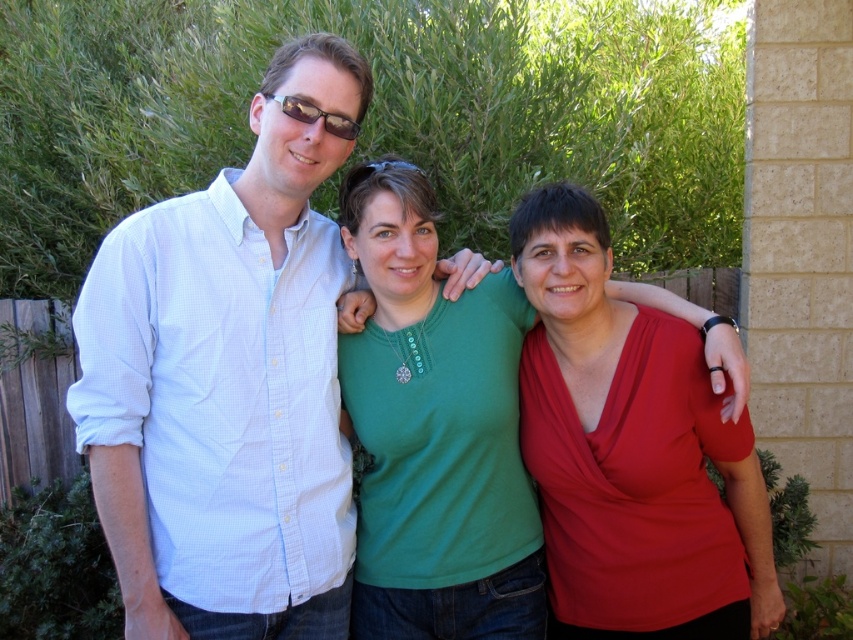
You are trying to decide which of the two shirts, the white checkered shirt at left or the green matte shirt at center, would be more comfortable to wear in a crowded event. Considering their sizes, which one might be more suitable?

The white checkered shirt at left is larger in width than the green matte shirt at center, so it might be less suitable for a crowded event where space is limited.

You are standing in front of the group of three people in the image. You need to determine which of the two points, point (149, 304) or point (399, 538), is closer to you. Which one is closer?

Point (149, 304) is closer to the viewer than point (399, 538).